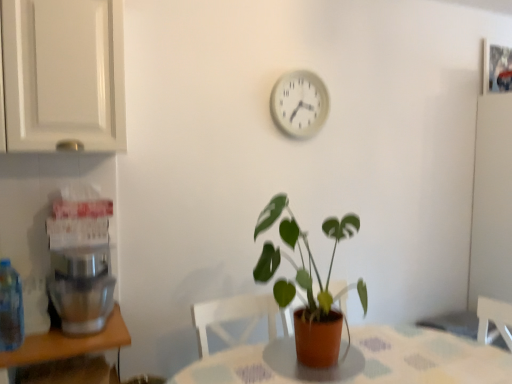
Question: Considering the positions of green matte plant at center and translucent plastic bottle at left in the image, is green matte plant at center wider or thinner than translucent plastic bottle at left?

Choices:
 (A) wide
 (B) thin

Answer: (A)

Question: Is green matte plant at center bigger or smaller than translucent plastic bottle at left?

Choices:
 (A) big
 (B) small

Answer: (A)

Question: Which object is the farthest from the patterned fabric table at center?

Choices:
 (A) white plastic clock at upper center
 (B) translucent plastic bottle at left
 (C) green matte plant at center
 (D) metallic silver coffee machine at left
 (E) white glossy cabinet at upper left

Answer: (E)

Question: Considering the real-world distances, which object is closest to the green matte plant at center?

Choices:
 (A) translucent plastic bottle at left
 (B) white plastic clock at upper center
 (C) metallic silver coffee machine at left
 (D) white glossy cabinet at upper left
 (E) patterned fabric table at center

Answer: (E)